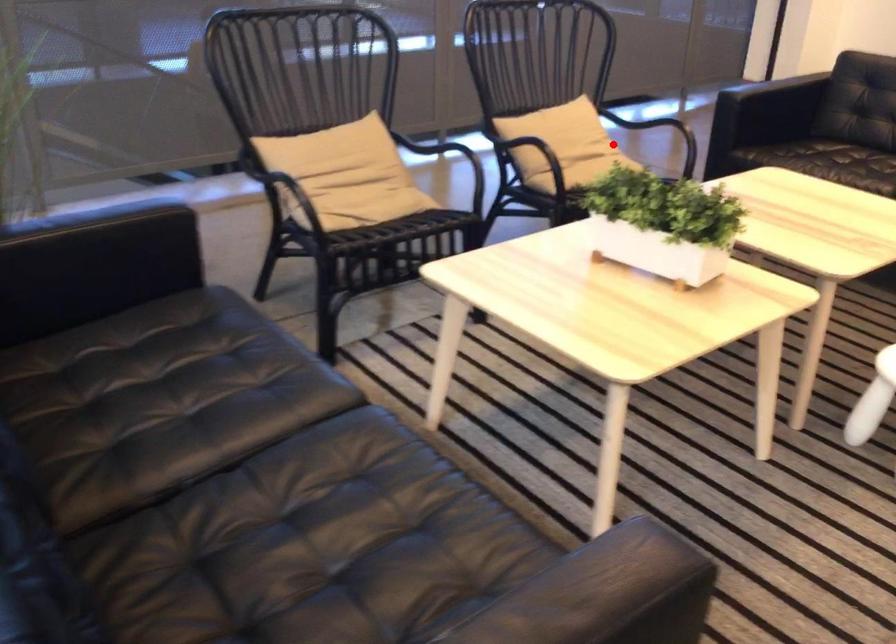
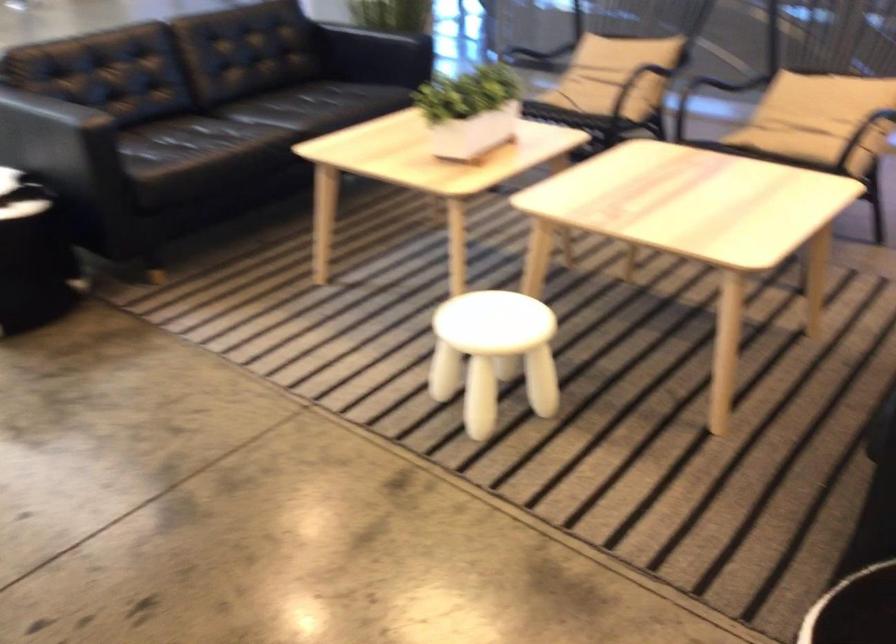
Find the pixel in the second image that matches the highlighted location in the first image.

(817, 118)